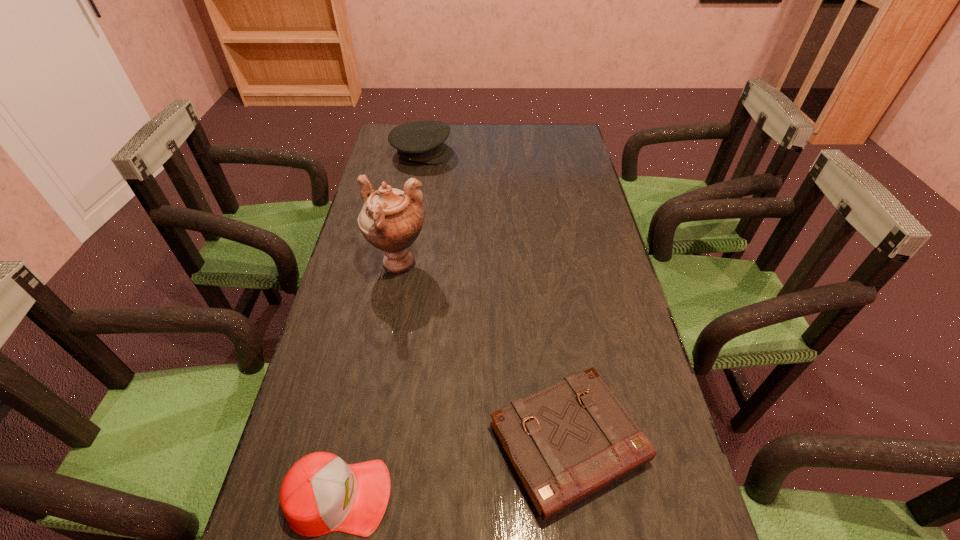
Where is `free space at the far right corner`? free space at the far right corner is located at coordinates (546, 134).

Where is `free area in between the beret and the rightmost object`? The width and height of the screenshot is (960, 540). free area in between the beret and the rightmost object is located at coordinates (495, 299).

You are a GUI agent. You are given a task and a screenshot of the screen. Output one action in this format:
    pyautogui.click(x=<x>, y=<y>)
    Task: Click on the free space between the third tallest object and the beret
    Image resolution: width=960 pixels, height=540 pixels.
    Given the screenshot: What is the action you would take?
    381,325

Where is `vacant point located between the second shortest object and the second farthest object`? The width and height of the screenshot is (960, 540). vacant point located between the second shortest object and the second farthest object is located at coordinates (369, 380).

Locate an element on the screen. vacant area between the baseball cap and the third shortest object is located at coordinates (381, 325).

The height and width of the screenshot is (540, 960). Identify the location of free spot between the hardback book and the third tallest object. (453, 470).

Where is `vacant space that is in between the hardback book and the third tallest object`? Image resolution: width=960 pixels, height=540 pixels. vacant space that is in between the hardback book and the third tallest object is located at coordinates (453, 470).

Identify the location of free spot between the beret and the rightmost object. (495, 299).

Where is `object that stands as the closest to the third nearest object`? Image resolution: width=960 pixels, height=540 pixels. object that stands as the closest to the third nearest object is located at coordinates [566, 442].

Select which object appears as the closest to the tallest object. Please provide its 2D coordinates. Your answer should be formatted as a tuple, i.e. [(x, y)], where the tuple contains the x and y coordinates of a point satisfying the conditions above.

[(566, 442)]